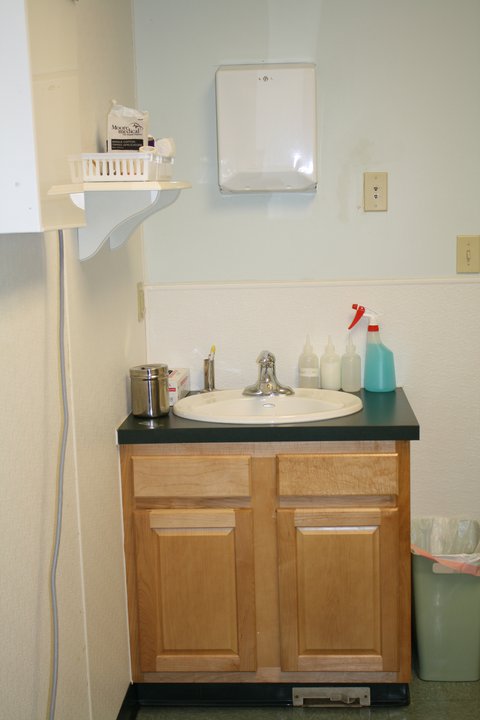
This screenshot has height=720, width=480. I want to click on outlet, so click(x=374, y=199).